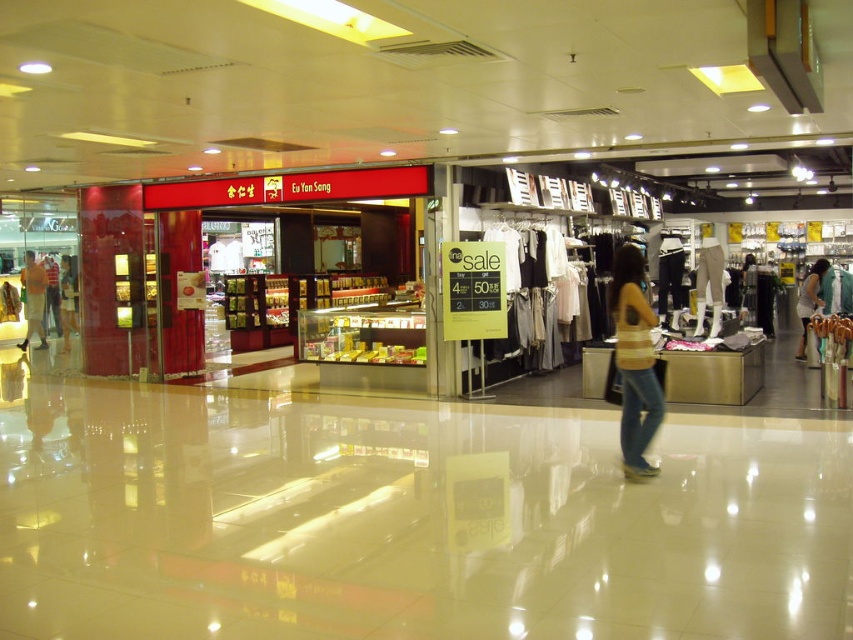
You are a shopper in the mall and want to compare the heights of two items displayed in the stores. You see the light beige fabric dress at center and the matte black shirt at left. Which item is shorter?

The light beige fabric dress at center is shorter than the matte black shirt at left.

You are a shopper looking at the striped jersey at center and the matte black shirt at left in the clothing store. Which item is positioned lower on the rack?

The striped jersey at center is located below the matte black shirt at left, so it is positioned lower on the rack.